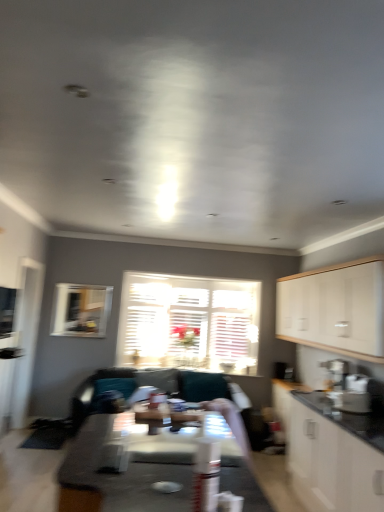
The image size is (384, 512). Describe the element at coordinates (330, 455) in the screenshot. I see `white matte cabinet at lower right, which is the 1th cabinetry in bottom-to-top order` at that location.

This screenshot has height=512, width=384. I want to click on wooden glossy table at center, placed as the first table when sorted from top to bottom, so click(x=176, y=441).

Where is `white matte cabinet at lower right, which is the 1th cabinetry in bottom-to-top order`? white matte cabinet at lower right, which is the 1th cabinetry in bottom-to-top order is located at coordinates (330, 455).

Considering the relative positions of white matte cabinet at lower right, marked as the 2th cabinetry in a top-to-bottom arrangement, and wooden glossy table at center, acting as the 2th table starting from the bottom, in the image provided, is white matte cabinet at lower right, marked as the 2th cabinetry in a top-to-bottom arrangement, to the left or to the right of wooden glossy table at center, acting as the 2th table starting from the bottom,?

Clearly, white matte cabinet at lower right, marked as the 2th cabinetry in a top-to-bottom arrangement, is on the right of wooden glossy table at center, acting as the 2th table starting from the bottom, in the image.

Between white matte cabinet at lower right, which is the 1th cabinetry in bottom-to-top order, and wooden glossy table at center, placed as the first table when sorted from top to bottom, which one has larger size?

With larger size is white matte cabinet at lower right, which is the 1th cabinetry in bottom-to-top order.

Considering the relative sizes of white matte cabinet at lower right, which is the 1th cabinetry in bottom-to-top order, and wooden glossy table at center, placed as the first table when sorted from top to bottom, in the image provided, is white matte cabinet at lower right, which is the 1th cabinetry in bottom-to-top order, wider than wooden glossy table at center, placed as the first table when sorted from top to bottom,?

No, white matte cabinet at lower right, which is the 1th cabinetry in bottom-to-top order, is not wider than wooden glossy table at center, placed as the first table when sorted from top to bottom.

Are white matte cabinet at lower right, which is the 1th cabinetry in bottom-to-top order, and wooden glossy table at center, placed as the first table when sorted from top to bottom, located far from each other?

Yes, white matte cabinet at lower right, which is the 1th cabinetry in bottom-to-top order, and wooden glossy table at center, placed as the first table when sorted from top to bottom, are quite far apart.

Does smooth white table at center, which is the 1th table from bottom to top, turn towards teal fabric couch at center?

No.

Consider the image. Which of these two, smooth white table at center, which is the 1th table from bottom to top, or teal fabric couch at center, stands taller?

With more height is teal fabric couch at center.

From a real-world perspective, is smooth white table at center, which is counted as the second table, starting from the top, located higher than teal fabric couch at center?

Yes, from a real-world perspective, smooth white table at center, which is counted as the second table, starting from the top, is over teal fabric couch at center

Relative to teal fabric couch at center, is clear glass window at upper left, acting as the first window starting from the front, in front or behind?

Visually, clear glass window at upper left, acting as the first window starting from the front, is located behind teal fabric couch at center.

Is clear glass window at upper left, acting as the 1th window starting from the left, next to teal fabric couch at center?

No, clear glass window at upper left, acting as the 1th window starting from the left, is not with teal fabric couch at center.

Can teal fabric couch at center be found inside clear glass window at upper left, acting as the second window starting from the right?

Definitely not — teal fabric couch at center is not inside clear glass window at upper left, acting as the second window starting from the right.

Find the location of a particular element. window that appears on the left of teal fabric couch at center is located at coordinates (81, 310).

Considering the relative positions of white matte cabinet at right, which is the first cabinetry from top to bottom, and satin silver coffee maker at right in the image provided, is white matte cabinet at right, which is the first cabinetry from top to bottom, to the right of satin silver coffee maker at right from the viewer's perspective?

Incorrect, white matte cabinet at right, which is the first cabinetry from top to bottom, is not on the right side of satin silver coffee maker at right.

From the image's perspective, would you say white matte cabinet at right, which appears as the second cabinetry when ordered from the bottom, is positioned over satin silver coffee maker at right?

Yes.

Based on the photo, which object is further away from the camera, white matte cabinet at right, which appears as the second cabinetry when ordered from the bottom, or satin silver coffee maker at right?

satin silver coffee maker at right.

Which of these two, white matte cabinet at right, which appears as the second cabinetry when ordered from the bottom, or satin silver coffee maker at right, is smaller?

satin silver coffee maker at right.

Is clear glass window at upper left, acting as the first window starting from the front, next to satin silver coffee maker at right and touching it?

clear glass window at upper left, acting as the first window starting from the front, and satin silver coffee maker at right are clearly separated.

Which object is wider, clear glass window at upper left, acting as the first window starting from the front, or satin silver coffee maker at right?

With larger width is satin silver coffee maker at right.

What's the angular difference between clear glass window at upper left, acting as the 1th window starting from the left, and satin silver coffee maker at right's facing directions?

clear glass window at upper left, acting as the 1th window starting from the left, and satin silver coffee maker at right are facing 91.7 degrees away from each other.

Does clear glass window at upper left, acting as the second window starting from the right, lie in front of satin silver coffee maker at right?

No, the depth of clear glass window at upper left, acting as the second window starting from the right, is greater than that of satin silver coffee maker at right.

What's the angular difference between satin silver coffee maker at right and wooden glossy table at center, placed as the first table when sorted from top to bottom,'s facing directions?

There is a 177-degree angle between the facing directions of satin silver coffee maker at right and wooden glossy table at center, placed as the first table when sorted from top to bottom.

Locate an element on the screen. The image size is (384, 512). the 1st table below the satin silver coffee maker at right (from a real-world perspective) is located at coordinates (176, 441).

Consider the image. Visually, is satin silver coffee maker at right positioned to the left or to the right of wooden glossy table at center, acting as the 2th table starting from the bottom?

Based on their positions, satin silver coffee maker at right is located to the right of wooden glossy table at center, acting as the 2th table starting from the bottom.

From the image's perspective, is satin silver coffee maker at right above or below wooden glossy table at center, placed as the first table when sorted from top to bottom?

From the image's perspective, satin silver coffee maker at right appears below wooden glossy table at center, placed as the first table when sorted from top to bottom.

You are a GUI agent. You are given a task and a screenshot of the screen. Output one action in this format:
    pyautogui.click(x=<x>, y=<y>)
    Task: Click on the couch below the white matte cabinet at right, which appears as the second cabinetry when ordered from the bottom (from a real-world perspective)
    This screenshot has width=384, height=512.
    Given the screenshot: What is the action you would take?
    pyautogui.click(x=99, y=392)

Can you tell me how much teal fabric couch at center and white matte cabinet at right, which appears as the second cabinetry when ordered from the bottom, differ in facing direction?

There is a 89.6-degree angle between the facing directions of teal fabric couch at center and white matte cabinet at right, which appears as the second cabinetry when ordered from the bottom.

Would you say white matte cabinet at right, which appears as the second cabinetry when ordered from the bottom, is part of teal fabric couch at center's contents?

Definitely not — white matte cabinet at right, which appears as the second cabinetry when ordered from the bottom, is not inside teal fabric couch at center.

Which is behind, point (201, 385) or point (276, 304)?

Point (276, 304)

Starting from the wooden glossy table at center, placed as the first table when sorted from top to bottom, which cabinetry is the 1st one behind? Please provide its 2D coordinates.

[(330, 455)]

This screenshot has height=512, width=384. What are the coordinates of `couch that appears on the left of smooth white table at center, which is counted as the second table, starting from the top` in the screenshot? It's located at (99, 392).

From the image, which object appears to be nearer to smooth white table at center, which is the 1th table from bottom to top, white wooden blinds at center, which appears as the second window when viewed from the left, or transparent glass door at left?

transparent glass door at left lies closer to smooth white table at center, which is the 1th table from bottom to top, than the other object.

When comparing their distances from transparent glass door at left, does clear glass window screen at left or teal fabric couch at center seem further?

teal fabric couch at center is positioned further to the anchor transparent glass door at left.

From the picture: Estimate the real-world distances between objects in this image. Which object is further from teal fabric couch at center, white matte cabinet at lower right, marked as the 2th cabinetry in a top-to-bottom arrangement, or white matte cabinet at right, which appears as the second cabinetry when ordered from the bottom?

white matte cabinet at right, which appears as the second cabinetry when ordered from the bottom, lies further to teal fabric couch at center than the other object.

From the image, which object appears to be nearer to transparent glass door at left, teal fabric couch at center or white matte cabinet at right, which is the first cabinetry from top to bottom?

Among the two, teal fabric couch at center is located nearer to transparent glass door at left.

From the image, which object appears to be farther from white matte cabinet at right, which is the first cabinetry from top to bottom, clear glass window screen at left or satin silver coffee maker at right?

clear glass window screen at left is further to white matte cabinet at right, which is the first cabinetry from top to bottom.

When comparing their distances from teal fabric couch at center, does white wooden blinds at center, the first window when ordered from back to front, or wooden glossy table at center, placed as the first table when sorted from top to bottom, seem closer?

white wooden blinds at center, the first window when ordered from back to front, is closer to teal fabric couch at center.

When comparing their distances from satin silver coffee maker at right, does clear glass window at upper left, acting as the first window starting from the front, or clear glass window screen at left seem closer?

The object closer to satin silver coffee maker at right is clear glass window at upper left, acting as the first window starting from the front.

When comparing their distances from smooth white table at center, which is counted as the second table, starting from the top, does clear glass window at upper left, the second window when ordered from back to front, or teal fabric couch at center seem closer?

teal fabric couch at center is positioned closer to the anchor smooth white table at center, which is counted as the second table, starting from the top.

At what (x,y) coordinates should I click in order to perform the action: click on window located between wooden glossy table at center, placed as the first table when sorted from top to bottom, and white wooden blinds at center, the first window from the right, in the depth direction. Please return your answer as a coordinate pair (x, y). The image size is (384, 512). Looking at the image, I should click on (81, 310).

Image resolution: width=384 pixels, height=512 pixels. In order to click on couch positioned between smooth white table at center, which is the 1th table from bottom to top, and clear glass window at upper left, acting as the second window starting from the right, from near to far in this screenshot , I will do `click(99, 392)`.

Identify the location of glass door positioned between white matte cabinet at lower right, which is the 1th cabinetry in bottom-to-top order, and white wooden blinds at center, which appears as the second window when viewed from the left, from near to far. This screenshot has height=512, width=384. (26, 338).

Find the location of a particular element. The width and height of the screenshot is (384, 512). couch located between wooden glossy table at center, placed as the first table when sorted from top to bottom, and clear glass window at upper left, acting as the first window starting from the front, in the depth direction is located at coordinates (99, 392).